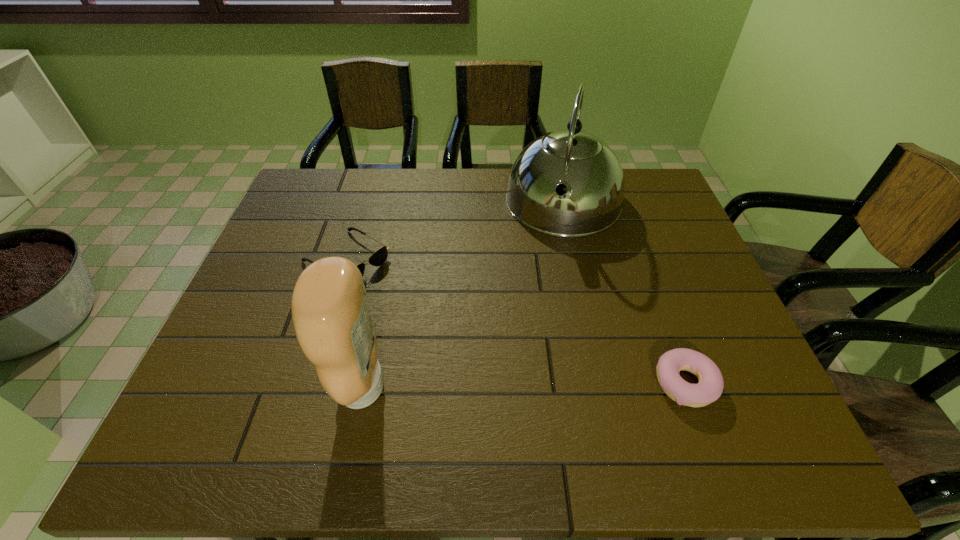
I want to click on object that is at the near right corner, so click(x=709, y=389).

This screenshot has width=960, height=540. Identify the location of vacant space at the far edge of the desktop. (444, 188).

Where is `vacant region at the near edge of the desktop`? The image size is (960, 540). vacant region at the near edge of the desktop is located at coordinates (636, 380).

The width and height of the screenshot is (960, 540). In order to click on vacant space at the left edge of the desktop in this screenshot , I will do `click(269, 261)`.

In the image, there is a desktop. At what (x,y) coordinates should I click in order to perform the action: click on vacant space at the right edge. Please return your answer as a coordinate pair (x, y). This screenshot has width=960, height=540. Looking at the image, I should click on (694, 331).

In the image, there is a desktop. Find the location of `free space at the far left corner`. free space at the far left corner is located at coordinates (332, 171).

Identify the location of vacant region at the near left corner. (266, 386).

Locate an element on the screen. free space that is in between the kettle and the doughnut is located at coordinates (624, 294).

Locate an element on the screen. vacant space that's between the sunglasses and the doughnut is located at coordinates (516, 321).

Locate an element on the screen. The height and width of the screenshot is (540, 960). free space between the condiment and the doughnut is located at coordinates (523, 386).